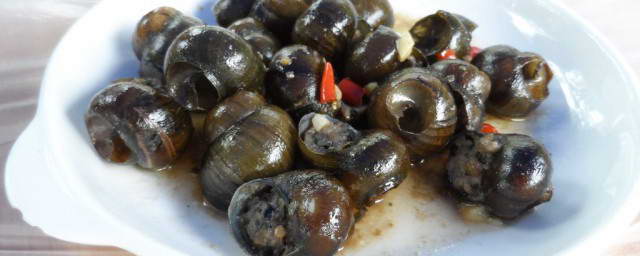
Find the location of a particular element. table is located at coordinates (628, 241), (614, 23), (17, 42), (11, 238).